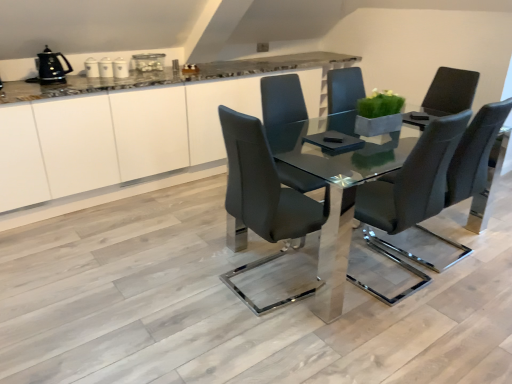
Locate an element on the screen. free spot to the left of clear glass table at center is located at coordinates (156, 257).